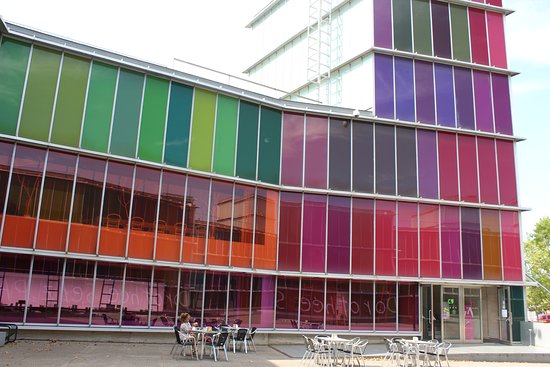
You are a GUI agent. You are given a task and a screenshot of the screen. Output one action in this format:
    pyautogui.click(x=<x>, y=<y>)
    Task: Click on the ladders
    This screenshot has height=367, width=550.
    Given the screenshot: What is the action you would take?
    pyautogui.click(x=152, y=299), pyautogui.click(x=97, y=293), pyautogui.click(x=50, y=299)